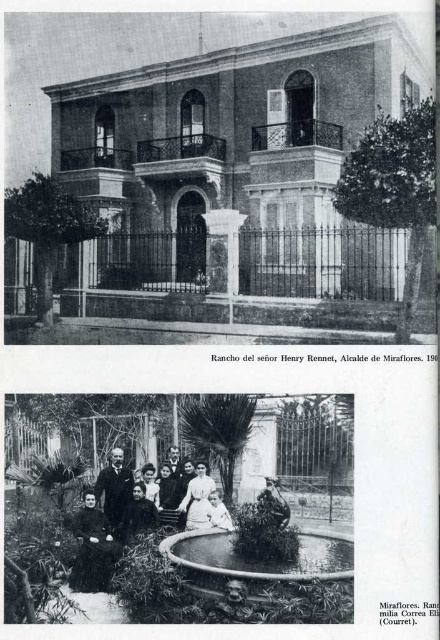
Consider the image. Is white cotton dress at center smaller than dark velvet dress at center?

Incorrect, white cotton dress at center is not smaller in size than dark velvet dress at center.

At what (x,y) coordinates should I click in order to perform the action: click on white cotton dress at center. Please return your answer as a coordinate pair (x, y). The width and height of the screenshot is (440, 640). Looking at the image, I should click on (109, 536).

The image size is (440, 640). What do you see at coordinates (109, 536) in the screenshot?
I see `white cotton dress at center` at bounding box center [109, 536].

The height and width of the screenshot is (640, 440). I want to click on white cotton dress at center, so click(109, 536).